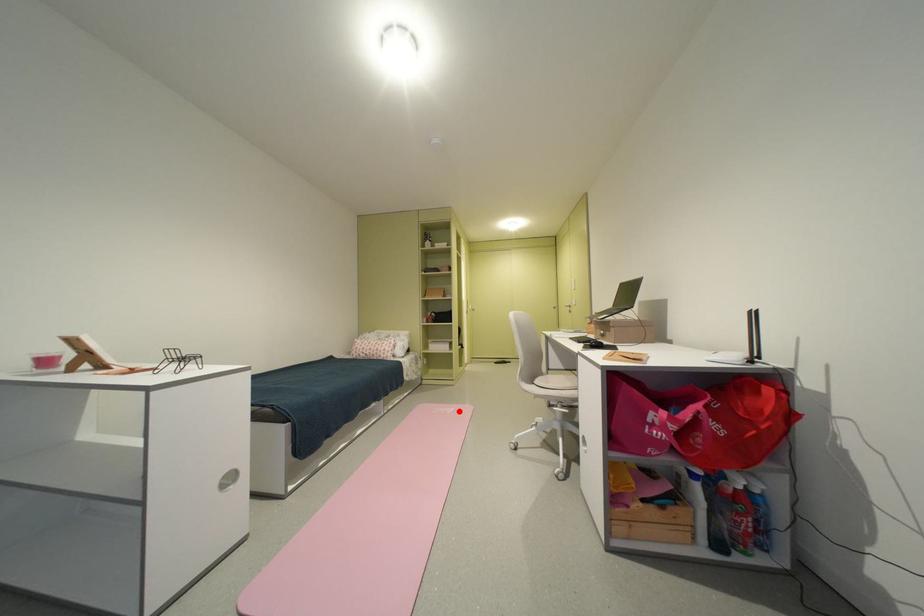
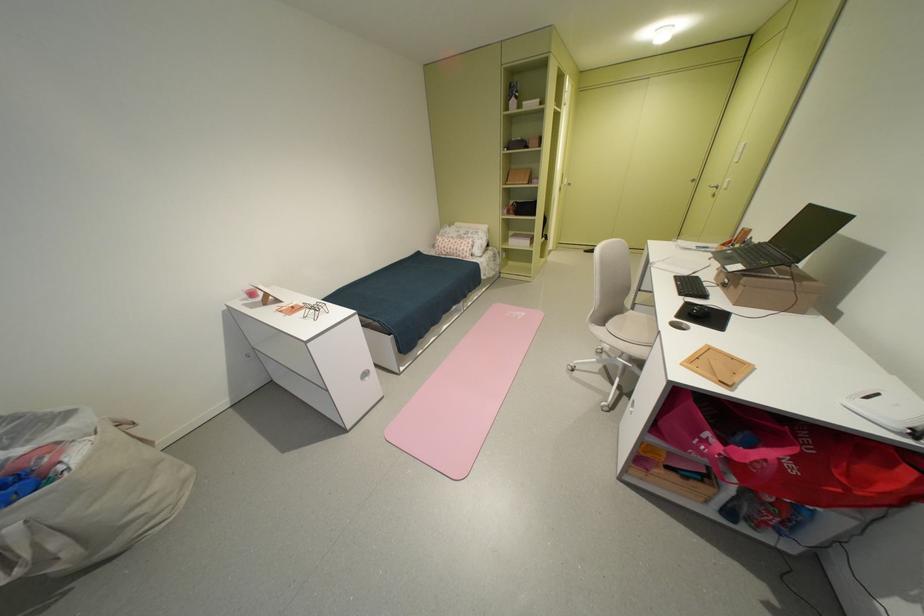
In the second image, find the point that corresponds to the highlighted location in the first image.

(530, 315)